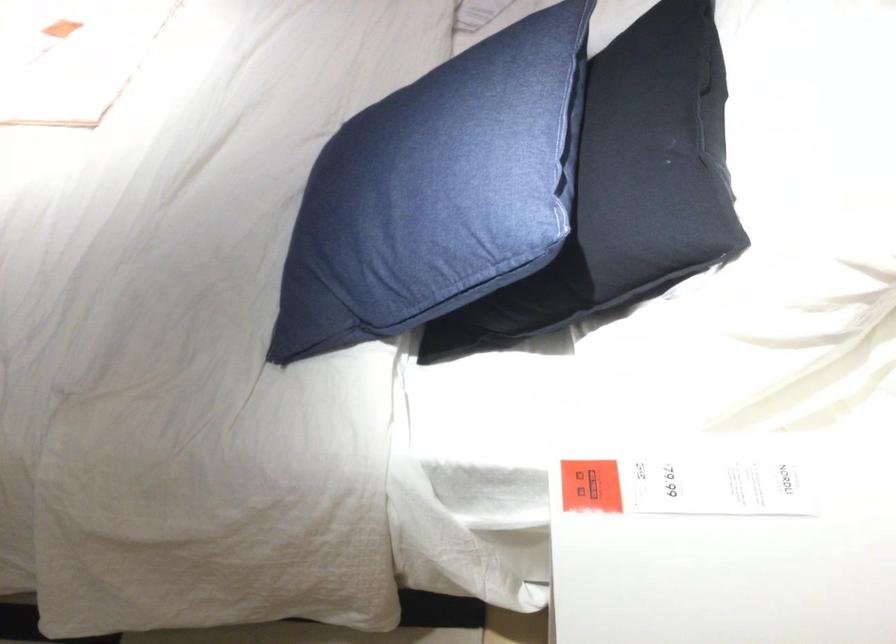
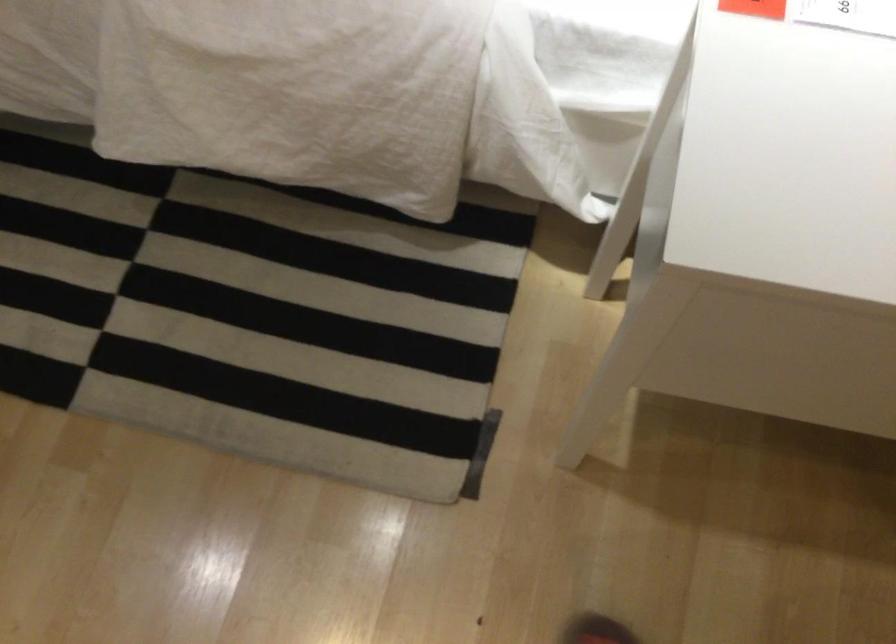
Looking at this image, the images are taken continuously from a first-person perspective. In which direction are you moving?

The movement direction of the cameraman is left, forward.